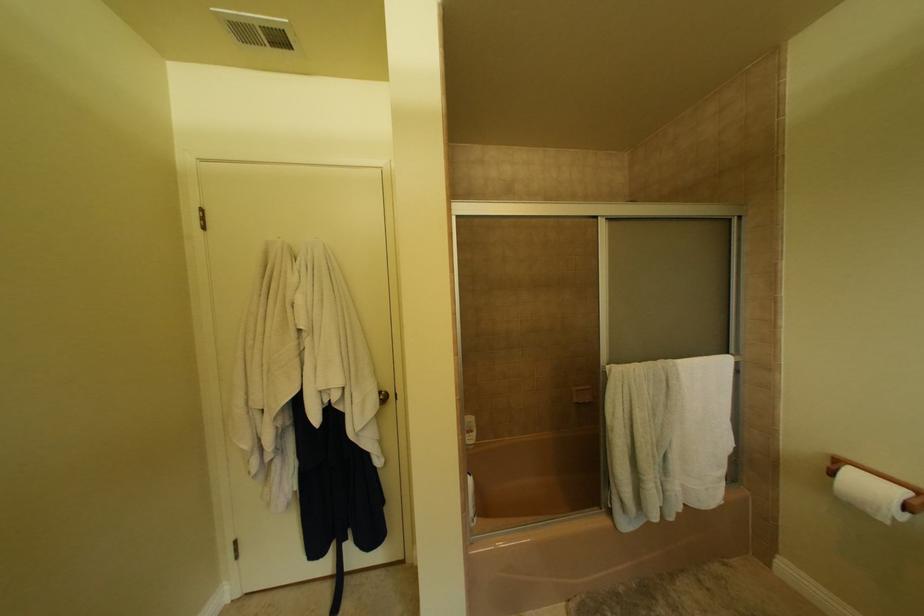
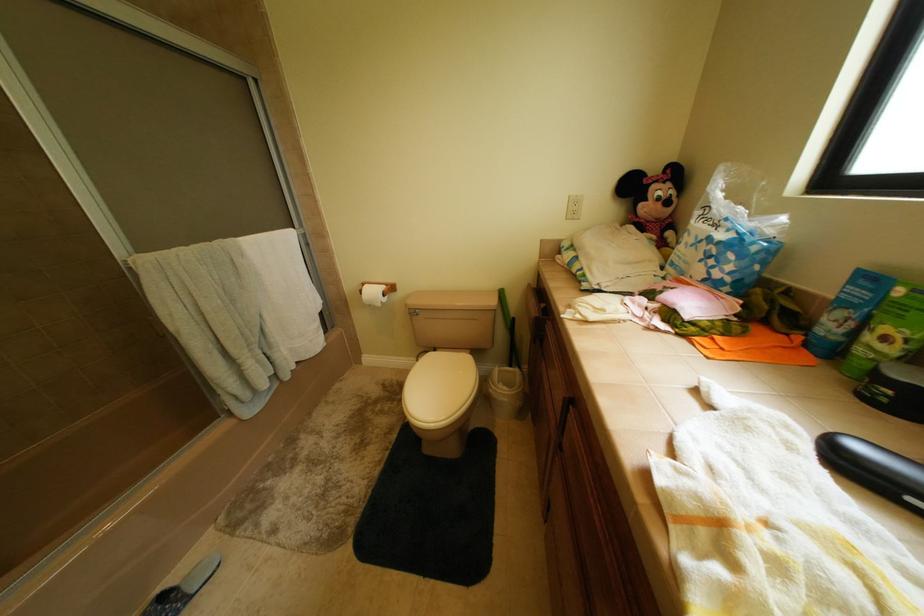
How did the camera likely rotate?

The rotation direction of the camera is right-down.